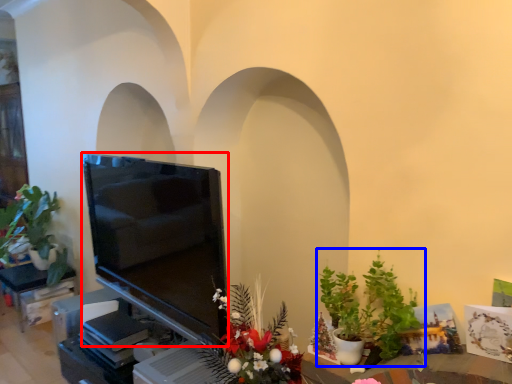
Question: Among these objects, which one is nearest to the camera, television (highlighted by a red box) or houseplant (highlighted by a blue box)?

Choices:
 (A) television
 (B) houseplant

Answer: (B)